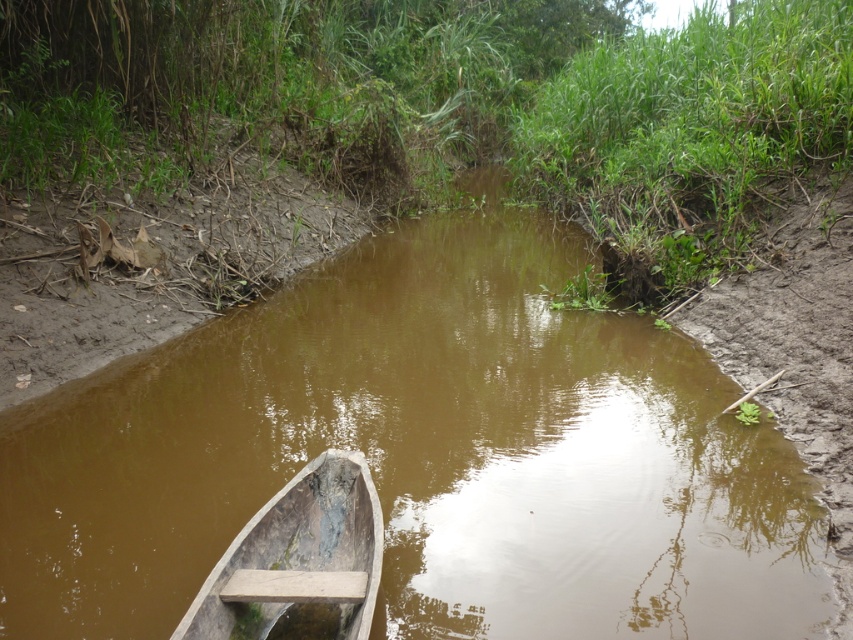
You are a hiker who wants to cross the brown muddy stream at center. There is green grass at center nearby. Which area is wider so you can walk on it safely?

The green grass at center occupies more space than the brown muddy stream at center, so you should walk on the green grass at center for safety.

You are standing at the origin point in the image. Which direction should you move to reach the brown muddy stream at center?

The brown muddy stream at center is located at coordinates approximately 0.713 on the x axis and 0.497 on the y axis, so you should move towards the center of the image to reach it.

You are standing on the green grass at center and want to cross to the other side of the brown muddy stream at center. Which direction should you walk to avoid stepping into the stream?

The brown muddy stream at center is below green grass at center, so you should walk towards the direction away from the stream to avoid stepping into it.